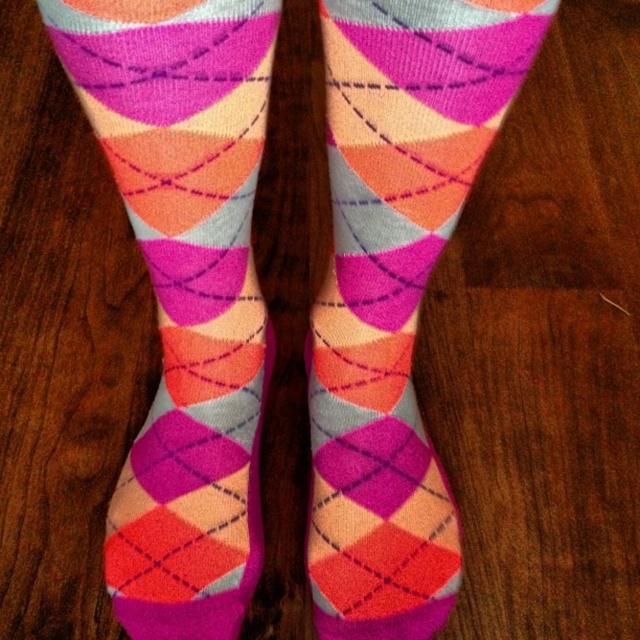
Is knitted argyle socks at center further to camera compared to matte argyle socks at center?

No, knitted argyle socks at center is closer to the viewer.

Is knitted argyle socks at center closer to camera compared to matte argyle socks at center?

Yes, it is in front of matte argyle socks at center.

Does point (77, 67) come closer to viewer compared to point (440, 145)?

That is True.

The width and height of the screenshot is (640, 640). What are the coordinates of `knitted argyle socks at center` in the screenshot? It's located at (184, 291).